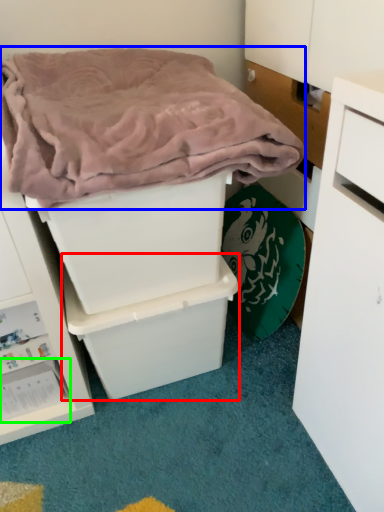
Question: Considering the real-world distances, which object is closest to storage box (highlighted by a red box)? blanket (highlighted by a blue box) or storage box (highlighted by a green box).

Choices:
 (A) blanket
 (B) storage box

Answer: (B)